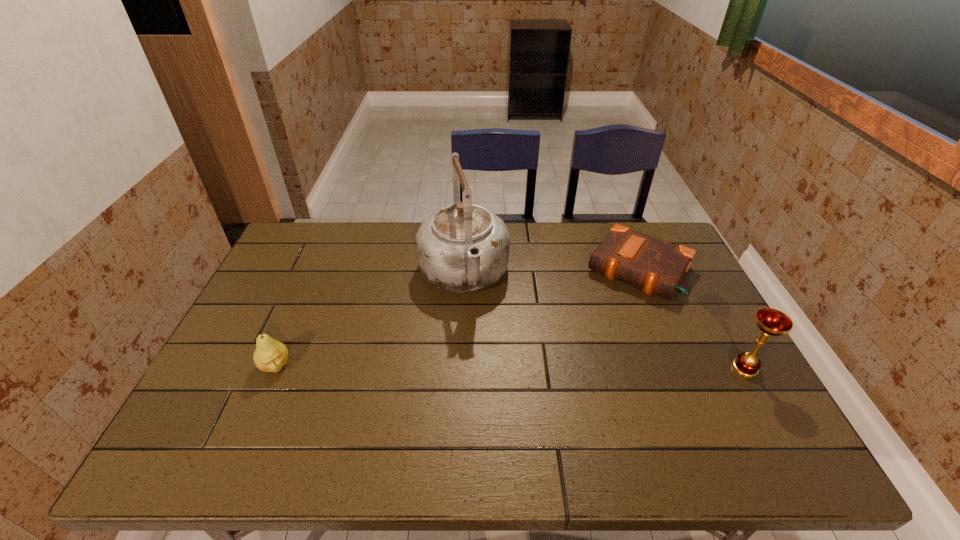
Locate an element on the screen. The width and height of the screenshot is (960, 540). vacant space that's between the chalice and the pear is located at coordinates (510, 367).

Image resolution: width=960 pixels, height=540 pixels. I want to click on free space that is in between the Bible and the third object from right to left, so click(x=551, y=272).

Identify the location of vacant region between the tallest object and the Bible. (551, 272).

Identify the location of object that ranks as the third closest to the Bible. Image resolution: width=960 pixels, height=540 pixels. (270, 355).

Identify which object is located as the second nearest to the Bible. Please provide its 2D coordinates. Your answer should be formatted as a tuple, i.e. [(x, y)], where the tuple contains the x and y coordinates of a point satisfying the conditions above.

[(462, 248)]

The width and height of the screenshot is (960, 540). I want to click on vacant space that satisfies the following two spatial constraints: 1. on the back side of the tallest object; 2. on the right side of the Bible, so click(x=464, y=269).